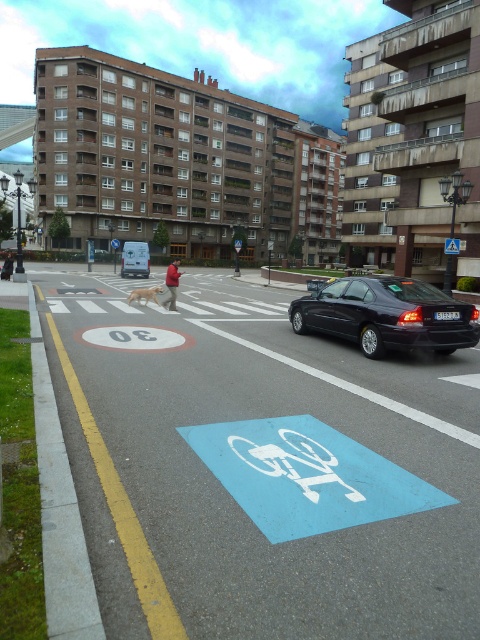
Is white plastic pedestrian crossing sign at upper center to the right of blue plastic sign at upper center from the viewer's perspective?

Correct, you'll find white plastic pedestrian crossing sign at upper center to the right of blue plastic sign at upper center.

Could you measure the distance between white plastic pedestrian crossing sign at upper center and blue plastic sign at upper center?

A distance of 37.42 meters exists between white plastic pedestrian crossing sign at upper center and blue plastic sign at upper center.

Find the location of a particular element. white plastic pedestrian crossing sign at upper center is located at coordinates (452, 244).

Find the location of a particular element. This screenshot has height=640, width=480. white plastic pedestrian crossing sign at upper center is located at coordinates (452, 244).

Who is higher up, blue painted bicycle sign at lower center or white plastic pedestrian crossing sign at upper center?

white plastic pedestrian crossing sign at upper center

Is blue painted bicycle sign at lower center bigger than white plastic pedestrian crossing sign at upper center?

Indeed, blue painted bicycle sign at lower center has a larger size compared to white plastic pedestrian crossing sign at upper center.

Who is more distant from viewer, (276, 428) or (456, 240)?

The point (456, 240) is behind.

Where is `blue painted bicycle sign at lower center`? This screenshot has height=640, width=480. blue painted bicycle sign at lower center is located at coordinates (263, 468).

Based on the photo, does blue painted bicycle sign at lower center have a lesser width compared to blue plastic sign at upper center?

No, blue painted bicycle sign at lower center is not thinner than blue plastic sign at upper center.

Does blue painted bicycle sign at lower center have a smaller size compared to blue plastic sign at upper center?

Yes.

Between point (133, 483) and point (113, 244), which one is positioned behind?

The point (113, 244) is more distant.

At what (x,y) coordinates should I click in order to perform the action: click on blue painted bicycle sign at lower center. Please return your answer as a coordinate pair (x, y). Looking at the image, I should click on coord(263,468).